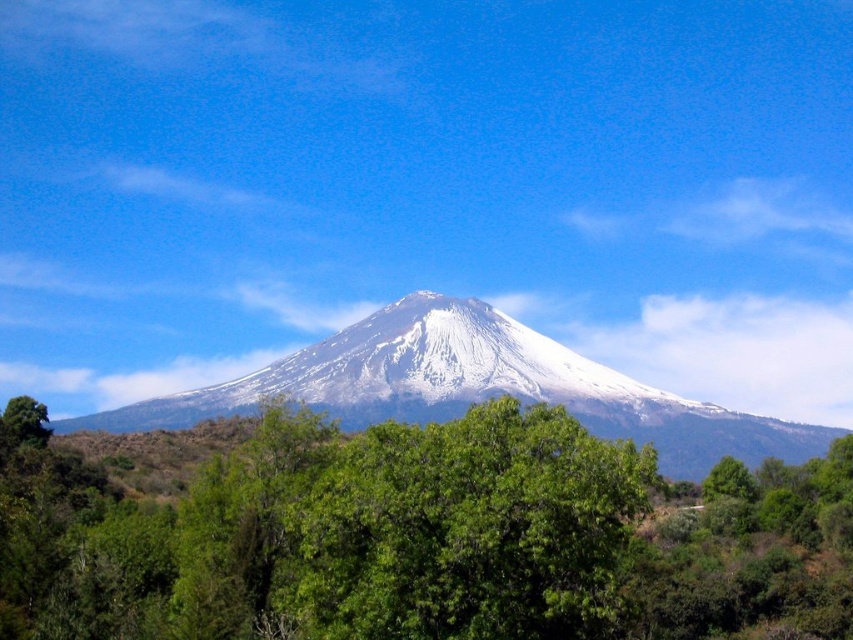
Question: Which point is farther to the camera?

Choices:
 (A) white snow-covered mountain at center
 (B) green leafy tree at center

Answer: (A)

Question: Which point is closer to the camera taking this photo?

Choices:
 (A) (389, 568)
 (B) (740, 428)

Answer: (A)

Question: Is green leafy tree at center positioned at the back of white snow-covered mountain at center?

Choices:
 (A) no
 (B) yes

Answer: (A)

Question: Can you confirm if green leafy tree at center is positioned to the left of white snow-covered mountain at center?

Choices:
 (A) yes
 (B) no

Answer: (A)

Question: Does green leafy tree at center have a lesser width compared to white snow-covered mountain at center?

Choices:
 (A) no
 (B) yes

Answer: (B)